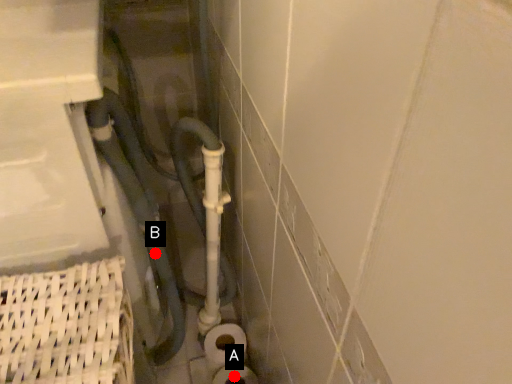
Question: Two points are circled on the image, labeled by A and B beside each circle. Among these points, which one is nearest to the camera?

Choices:
 (A) A is closer
 (B) B is closer

Answer: (B)